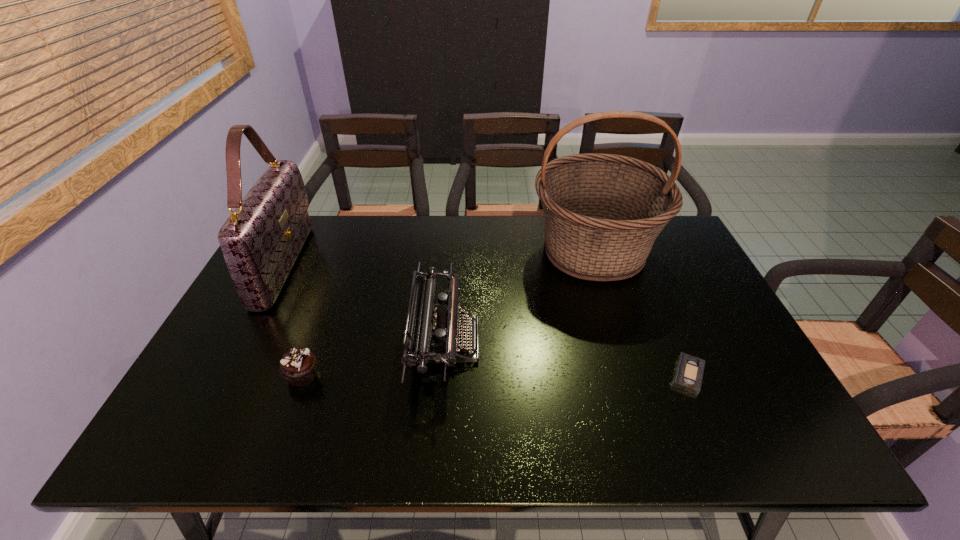
The image size is (960, 540). Identify the location of free space at the near edge of the desktop. (459, 441).

This screenshot has height=540, width=960. I want to click on vacant space at the right edge of the desktop, so click(x=702, y=388).

In the image, there is a desktop. Where is `free space at the near left corner`? The width and height of the screenshot is (960, 540). free space at the near left corner is located at coordinates (233, 436).

Locate an element on the screen. blank space at the near right corner of the desktop is located at coordinates (782, 440).

Where is `free space between the handbag and the typewriter`? The width and height of the screenshot is (960, 540). free space between the handbag and the typewriter is located at coordinates (365, 303).

Locate an element on the screen. free space between the cupcake and the videotape is located at coordinates (495, 375).

I want to click on free space between the typewriter and the basket, so click(519, 296).

You are a GUI agent. You are given a task and a screenshot of the screen. Output one action in this format:
    pyautogui.click(x=<x>, y=<y>)
    Task: Click on the unoccupied area between the videotape and the third object from left to right
    Image resolution: width=960 pixels, height=540 pixels.
    Given the screenshot: What is the action you would take?
    pyautogui.click(x=566, y=358)

Find the location of `vacant area between the second object from left to right and the third tallest object`. vacant area between the second object from left to right and the third tallest object is located at coordinates (373, 359).

This screenshot has width=960, height=540. Identify the location of vacant point located between the fourth object from right to left and the shortest object. (495, 375).